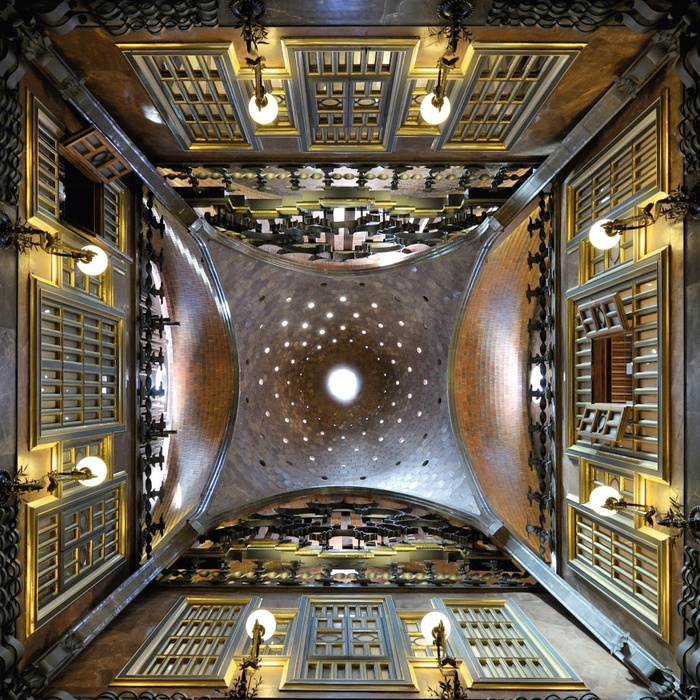
Locate an element on the screen. window is located at coordinates (603, 413), (608, 381), (77, 204), (92, 146).